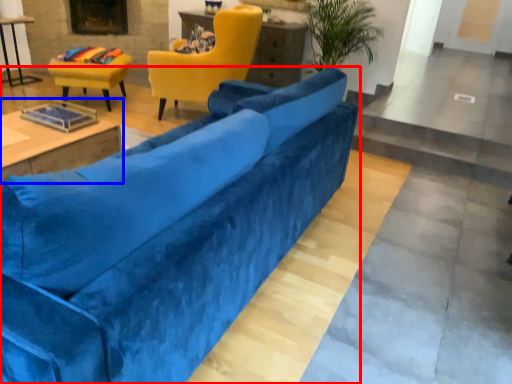
Question: Which object is further to the camera taking this photo, studio couch (highlighted by a red box) or table (highlighted by a blue box)?

Choices:
 (A) studio couch
 (B) table

Answer: (B)